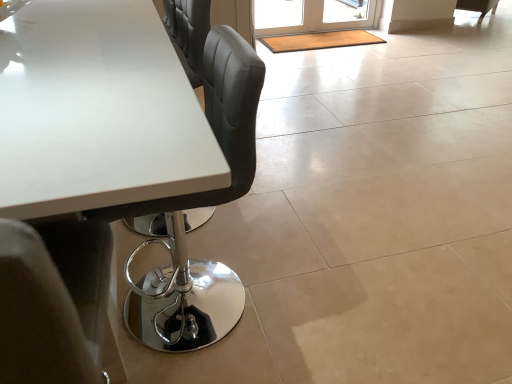
Question: In terms of size, does translucent glass screen door at upper center appear bigger or smaller than matte black chair at upper right?

Choices:
 (A) small
 (B) big

Answer: (A)

Question: From a real-world perspective, is translucent glass screen door at upper center positioned above or below matte black chair at upper right?

Choices:
 (A) below
 (B) above

Answer: (B)

Question: Which of these objects is positioned farthest from the white glossy table at upper left?

Choices:
 (A) matte black chair at upper right
 (B) translucent glass screen door at upper center

Answer: (A)

Question: Estimate the real-world distances between objects in this image. Which object is farther from the matte black chair at upper right?

Choices:
 (A) translucent glass screen door at upper center
 (B) white glossy table at upper left

Answer: (B)